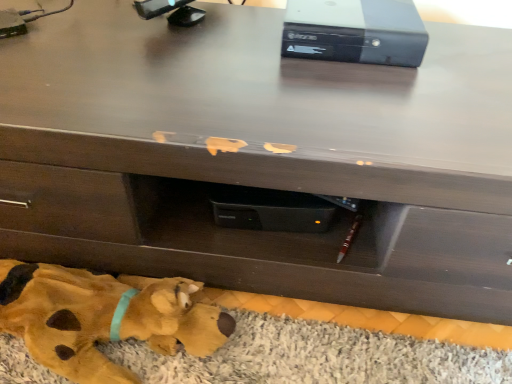
Where is `free spot in front of black plastic computer at upper center`? free spot in front of black plastic computer at upper center is located at coordinates (365, 100).